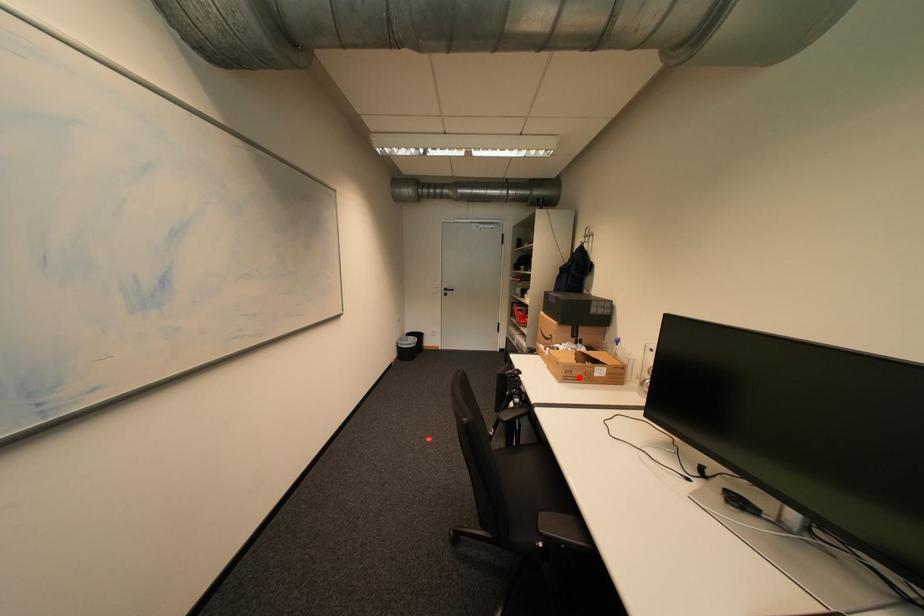
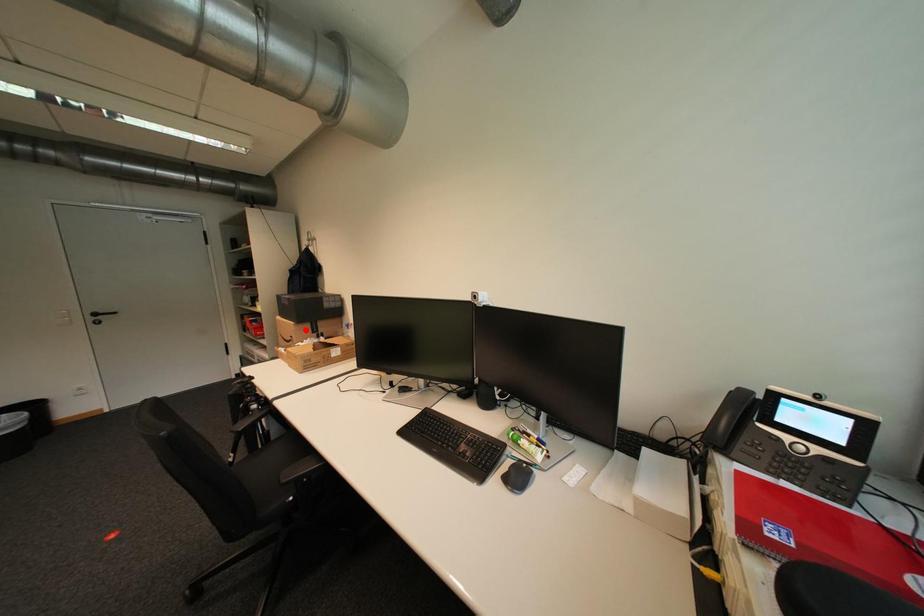
I am providing you with two images of the same scene from different viewpoints. A red point is marked on the first image and another point is marked on the second image. Do the highlighted points in image1 and image2 indicate the same real-world spot?

No